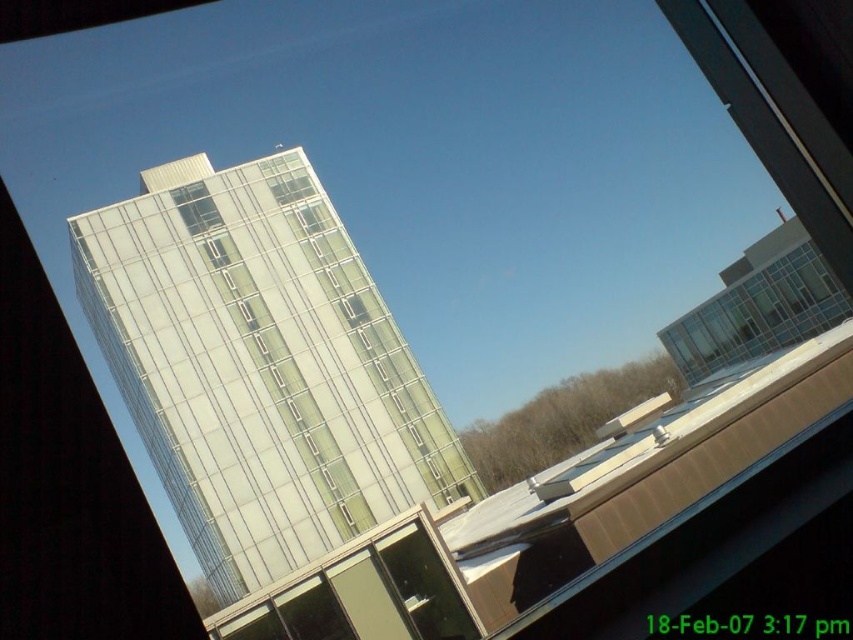
Question: Which object is the farthest from the clear glass building at center?

Choices:
 (A) clear glass window at upper center
 (B) transparent glass window at upper right

Answer: (B)

Question: Which object appears farthest from the camera in this image?

Choices:
 (A) clear glass window at upper center
 (B) clear glass building at center

Answer: (A)

Question: Considering the real-world distances, which object is farthest from the transparent glass window at upper right?

Choices:
 (A) clear glass window at upper center
 (B) clear glass building at center

Answer: (A)

Question: Does clear glass building at center lie behind clear glass window at upper center?

Choices:
 (A) yes
 (B) no

Answer: (B)

Question: Does transparent glass window at upper right appear under clear glass window at upper center?

Choices:
 (A) yes
 (B) no

Answer: (A)

Question: Where is transparent glass window at upper right located in relation to clear glass window at upper center in the image?

Choices:
 (A) left
 (B) right

Answer: (B)